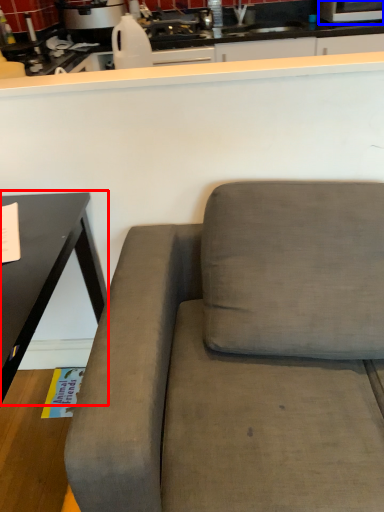
Question: Which object appears farthest to the camera in this image, table (highlighted by a red box) or appliance (highlighted by a blue box)?

Choices:
 (A) table
 (B) appliance

Answer: (B)